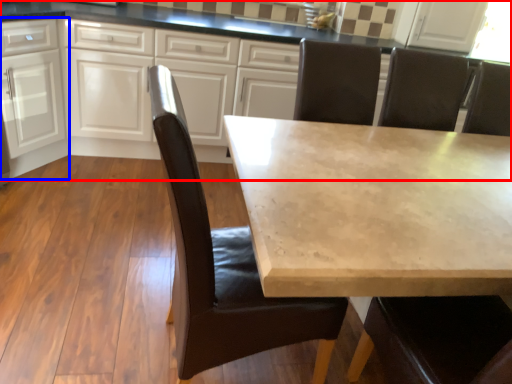
Question: Among these objects, which one is nearest to the camera, cabinetry (highlighted by a red box) or cabinetry (highlighted by a blue box)?

Choices:
 (A) cabinetry
 (B) cabinetry

Answer: (A)